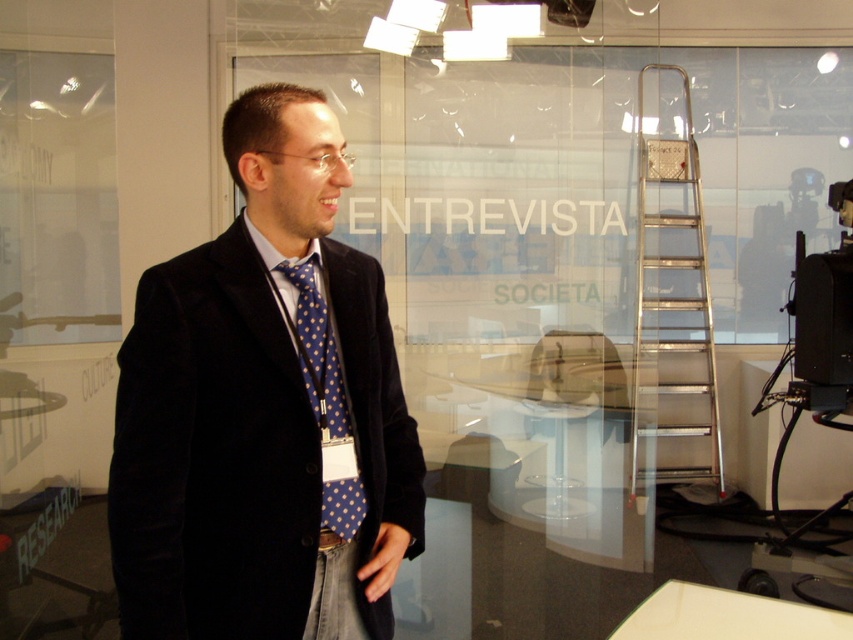
You are a fashion designer observing the man in the image. You need to determine the spatial relationship between the velvet black suit at center and the blue dotted fabric tie at center. Which one is positioned to the left?

The velvet black suit at center is to the left of the blue dotted fabric tie at center.

You are a photographer in a studio setting. You need to adjust the lighting to ensure both the velvet black suit at center and the blue dotted fabric tie at center are well lit. Given their distance apart, will you need to adjust the lights separately for each item?

The velvet black suit at center is 10.88 centimeters away from the blue dotted fabric tie at center. Since the distance between them is relatively small, you may not need to adjust the lights separately for each item. A single light adjustment could suffice to illuminate both.

You are a photographer in the studio and need to adjust the lighting equipment located at the top of the silver metallic ladder at right. Can you safely climb the ladder?

The silver metallic ladder at right is positioned at point (x=672, y=296), so yes, you can safely climb the ladder to adjust the lighting equipment.